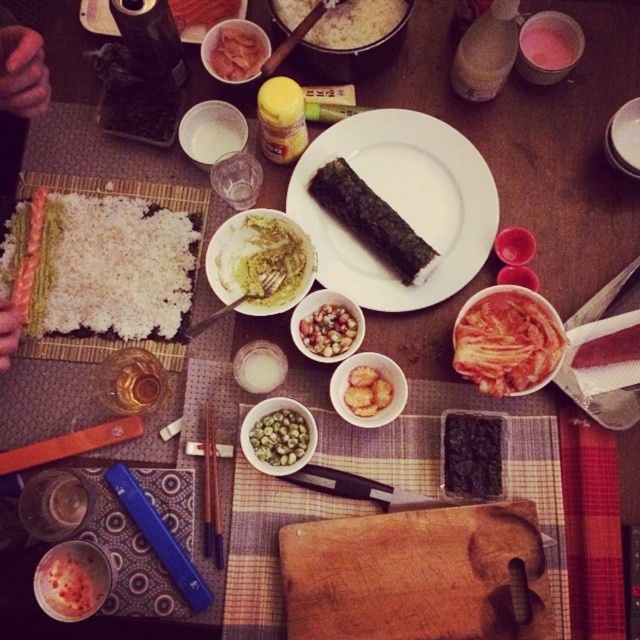
Does white rice at center appear on the left side of golden crispy fried at center?

Indeed, white rice at center is positioned on the left side of golden crispy fried at center.

Which is behind, point (304, 17) or point (390, 390)?

The point (304, 17) is behind.

Does point (365, 1) lie in front of point (352, 381)?

That is False.

The image size is (640, 640). In order to click on white rice at center in this screenshot , I will do `click(356, 22)`.

Does yellow creamy rice at center appear on the right side of smooth pinkish-red fish at center?

Indeed, yellow creamy rice at center is positioned on the right side of smooth pinkish-red fish at center.

I want to click on yellow creamy rice at center, so click(x=259, y=259).

Does green matte rice ball at center have a greater width compared to golden crispy fried at center?

Yes, green matte rice ball at center is wider than golden crispy fried at center.

Does green matte rice ball at center appear under golden crispy fried at center?

Actually, green matte rice ball at center is above golden crispy fried at center.

Who is more forward, (317, 323) or (355, 410)?

Point (355, 410)

Where is `green matte rice ball at center`? green matte rice ball at center is located at coordinates (328, 330).